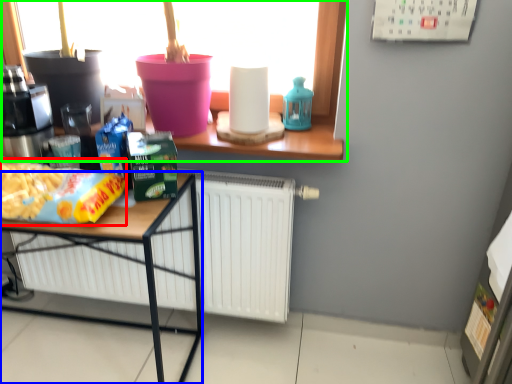
Question: Estimate the real-world distances between objects in this image. Which object is farther from food (highlighted by a red box), desk (highlighted by a blue box) or window (highlighted by a green box)?

Choices:
 (A) desk
 (B) window

Answer: (B)